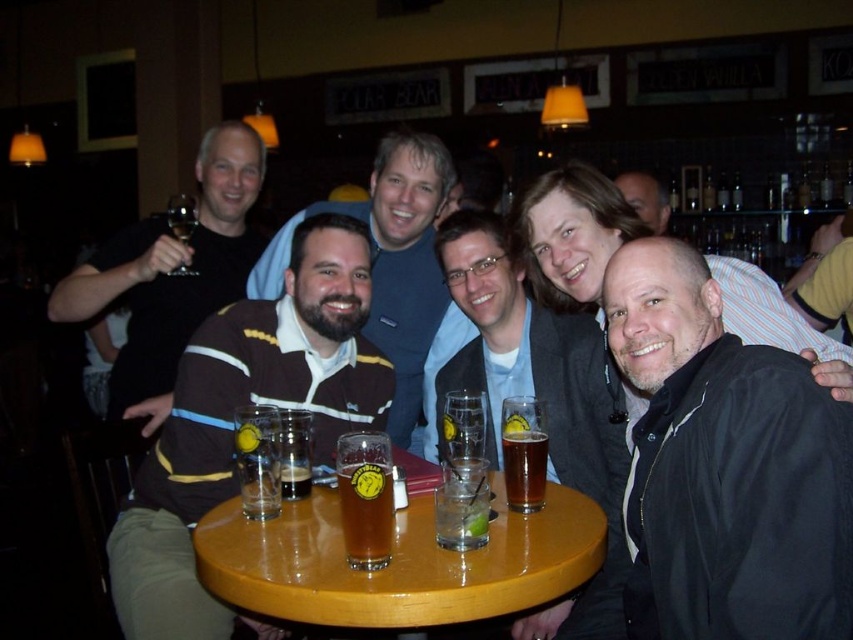
How much distance is there between matte black jacket at center and clear glass at table center?

The distance of matte black jacket at center from clear glass at table center is 28.72 inches.

Does matte black jacket at center appear over clear glass at table center?

Correct, matte black jacket at center is located above clear glass at table center.

Measure the distance between matte black jacket at center and camera.

The distance of matte black jacket at center from camera is 1.58 meters.

The height and width of the screenshot is (640, 853). I want to click on matte black jacket at center, so click(538, 397).

Is point (218, 148) positioned in front of point (508, 458)?

That is False.

Does black jersey at left lie in front of brown glass beer at center?

No, it is not.

Is point (178, 296) closer to camera compared to point (520, 472)?

No, it is not.

Identify the location of black jersey at left. The height and width of the screenshot is (640, 853). (173, 269).

Which of these two, black jersey at left or translucent glass mug at center, stands taller?

black jersey at left

Is black jersey at left shorter than translucent glass mug at center?

No.

Is point (252, 157) behind point (386, 522)?

That is True.

Identify the location of black jersey at left. This screenshot has width=853, height=640. (173, 269).